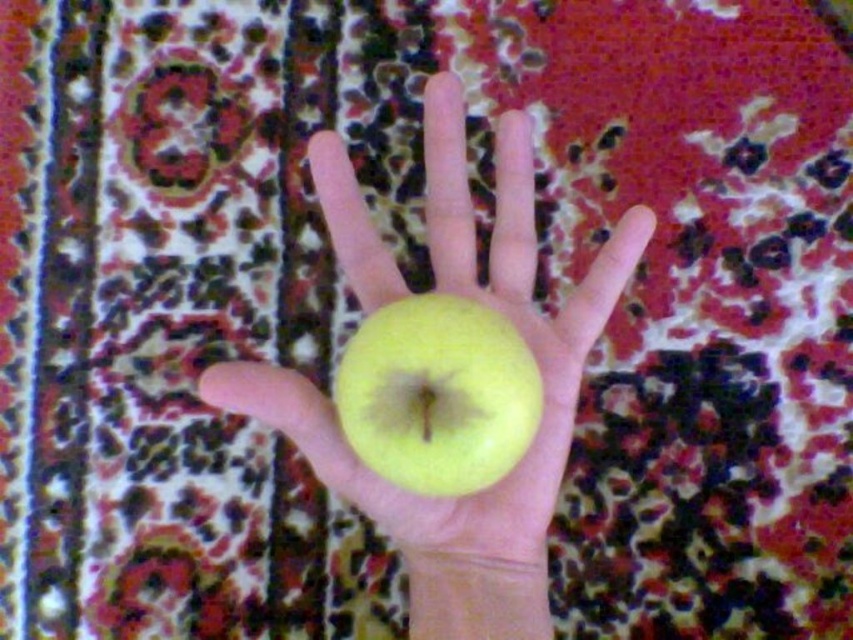
Question: Does yellow matte apple at center appear on the left side of green matte apple at center?

Choices:
 (A) no
 (B) yes

Answer: (B)

Question: Which of the following is the farthest from the observer?

Choices:
 (A) (431, 208)
 (B) (473, 330)

Answer: (A)

Question: Which object appears farthest from the camera in this image?

Choices:
 (A) green matte apple at center
 (B) yellow matte apple at center

Answer: (B)

Question: Does yellow matte apple at center appear over green matte apple at center?

Choices:
 (A) no
 (B) yes

Answer: (B)

Question: Can you confirm if yellow matte apple at center is positioned below green matte apple at center?

Choices:
 (A) no
 (B) yes

Answer: (A)